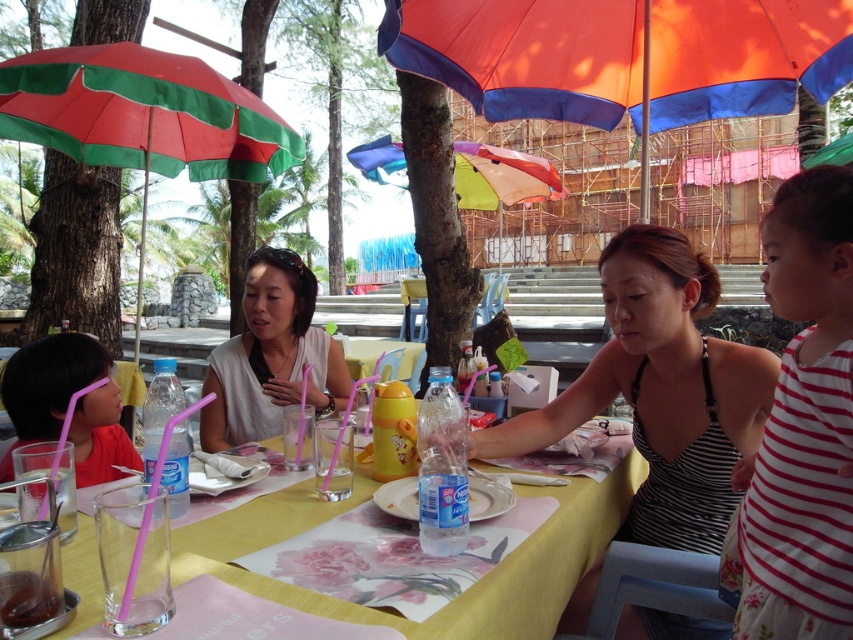
Looking at this image, you are a customer sitting at the orange fabric umbrella at center and want to see the menu placed under the green striped umbrella at left. Can you see the menu without moving your seat?

The orange fabric umbrella at center is in front of the green striped umbrella at left, so the menu under the green striped umbrella at left is blocked by the orange fabric umbrella at center. You cannot see the menu without moving your seat.

You are a server at the outdoor dining area and need to place a new menu on the table. Considering the white matte shirt at center and the translucent glass at lower left, which object should you avoid placing the menu near to prevent it from being obscured?

You should avoid placing the menu near the white matte shirt at center because it is taller than the translucent glass at lower left and could block the view of the menu.